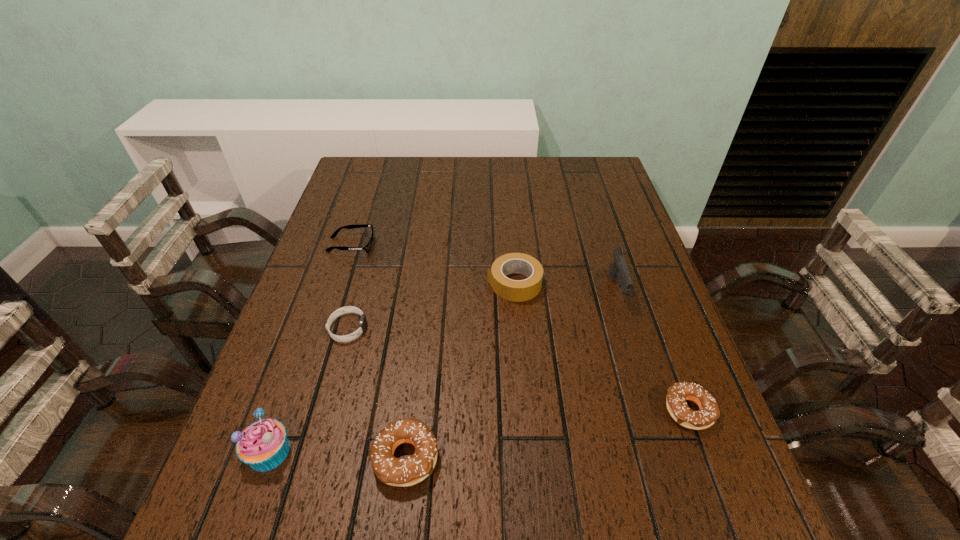
Find the location of a particular element. This screenshot has height=540, width=960. the fourth object from left to right is located at coordinates (401, 472).

This screenshot has height=540, width=960. I want to click on the left doughnut, so click(401, 472).

Image resolution: width=960 pixels, height=540 pixels. Identify the location of the right doughnut. (677, 394).

Find the location of a particular element. the rightmost object is located at coordinates (677, 394).

You are a GUI agent. You are given a task and a screenshot of the screen. Output one action in this format:
    pyautogui.click(x=<x>, y=<y>)
    Task: Click on the farthest object
    The width and height of the screenshot is (960, 540).
    Given the screenshot: What is the action you would take?
    pyautogui.click(x=367, y=248)

Find the location of a particular element. duct tape is located at coordinates (512, 290).

Find the location of a particular element. The image size is (960, 540). wristband is located at coordinates (348, 309).

Where is `the second object from right to left`? the second object from right to left is located at coordinates (618, 267).

Identify the location of muffin. The width and height of the screenshot is (960, 540). (263, 445).

This screenshot has height=540, width=960. What are the coordinates of `vacant space located 0.180m on the back of the fourth object from left to right` in the screenshot? It's located at pyautogui.click(x=419, y=350).